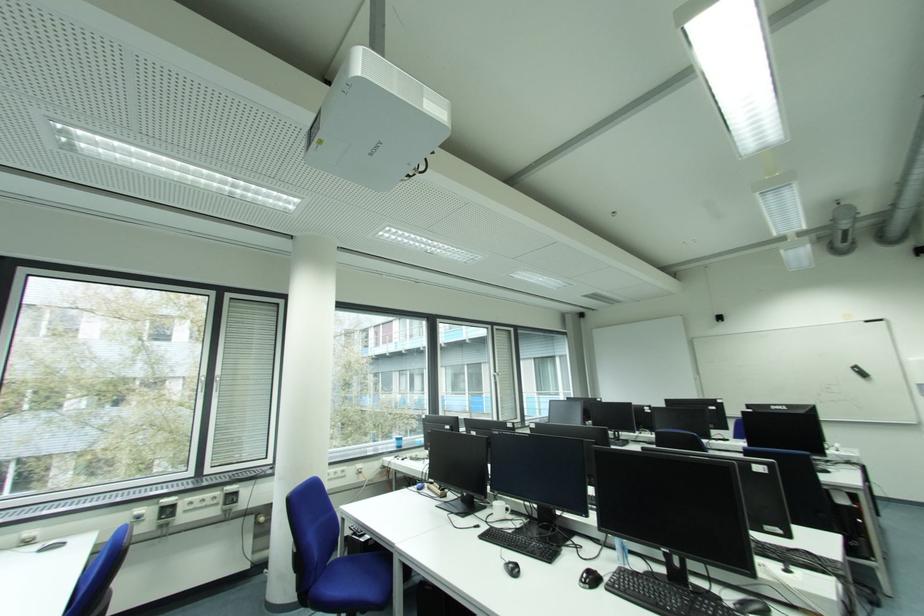
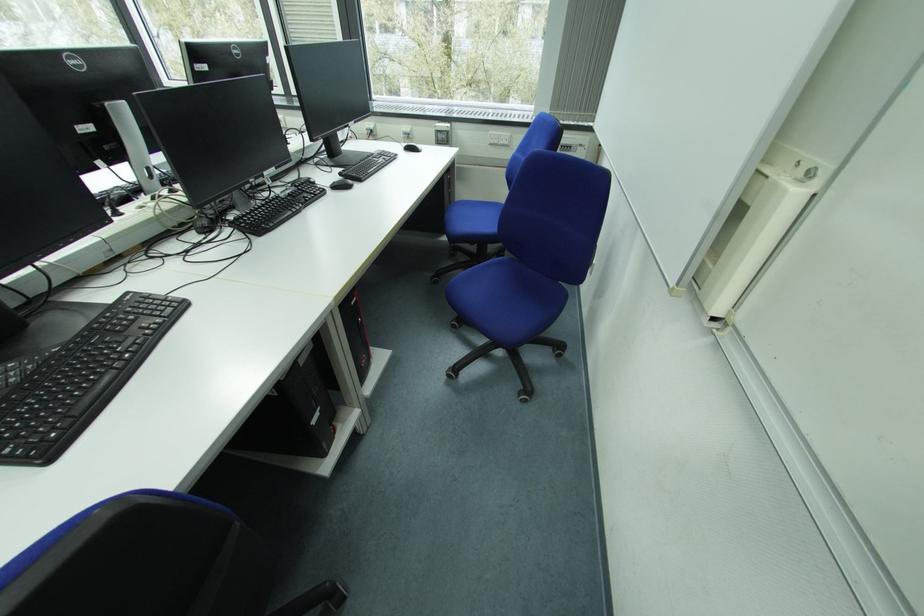
Question: I am providing you with two images of the same scene from different viewpoints. After the viewpoint changes to image2, which objects are now occluded?

Choices:
 (A) whiteboard sliding handle
 (B) red power button
 (C) black computer mouse
 (D) blue plastic cup

Answer: (D)